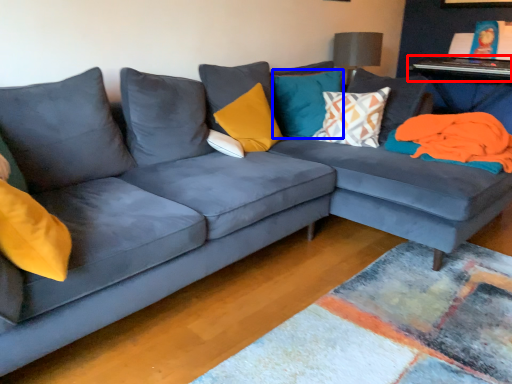
Question: Which point is closer to the camera, table (highlighted by a red box) or pillow (highlighted by a blue box)?

Choices:
 (A) table
 (B) pillow

Answer: (B)